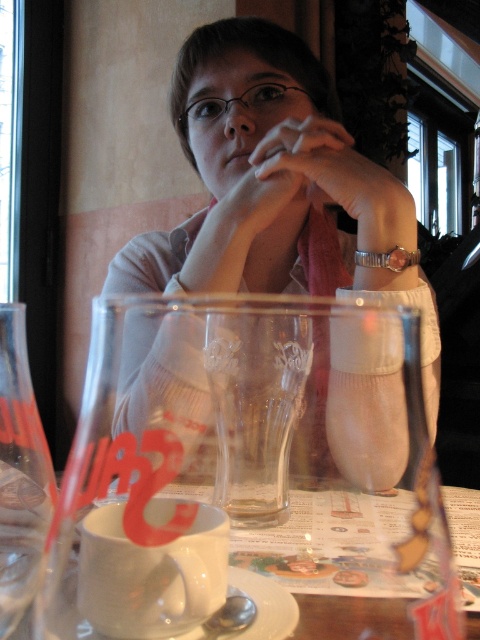
Question: Among these objects, which one is farthest from the camera?

Choices:
 (A) white glossy mug at center
 (B) matte skin hand at center
 (C) matte white sweater at center

Answer: (B)

Question: Among these points, which one is nearest to the camera?

Choices:
 (A) (283, 592)
 (B) (407, 260)

Answer: (A)

Question: Is transparent glass at center above white ceramic saucer at lower center?

Choices:
 (A) no
 (B) yes

Answer: (B)

Question: Does matte white sweater at center appear under white matte cup at lower center?

Choices:
 (A) yes
 (B) no

Answer: (B)

Question: Which object is farther from the camera taking this photo?

Choices:
 (A) white matte cup at lower center
 (B) white ceramic saucer at lower center

Answer: (B)

Question: Is matte white sweater at center below white ceramic saucer at lower center?

Choices:
 (A) yes
 (B) no

Answer: (B)